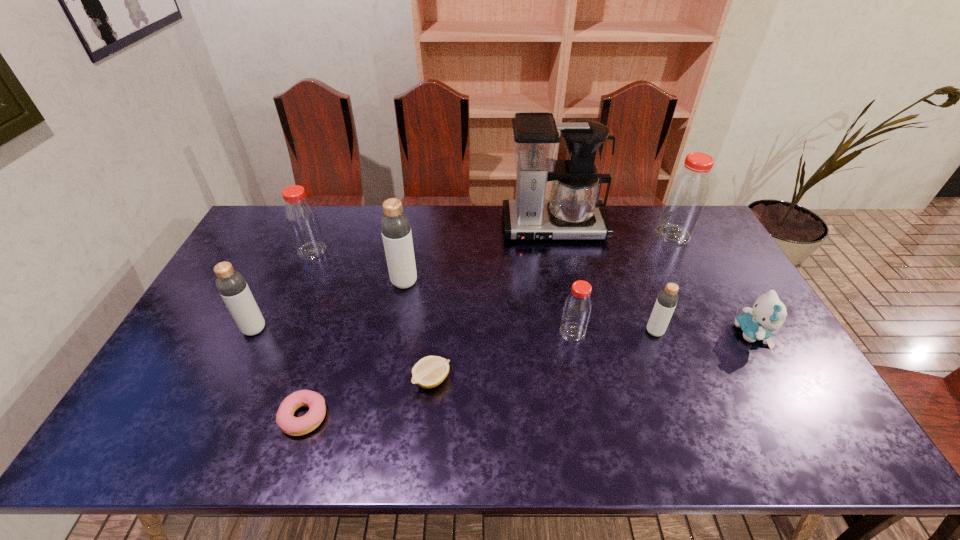
In order to click on object that is the eighth closest to the nearest red bottle in this screenshot , I will do [302, 220].

Identify which bottle is located as the third nearest to the rightmost bottle. Please provide its 2D coordinates. Your answer should be formatted as a tuple, i.e. [(x, y)], where the tuple contains the x and y coordinates of a point satisfying the conditions above.

[(395, 226)]

Locate an element on the screen. The image size is (960, 540). bottle that is the second closest one to the fourth object from left to right is located at coordinates (232, 286).

Find the location of a particular element. The height and width of the screenshot is (540, 960). red bottle that is the closest to the blue kitten is located at coordinates (685, 200).

Point out which red bottle is positioned as the second nearest to the biggest red bottle. Please provide its 2D coordinates. Your answer should be formatted as a tuple, i.e. [(x, y)], where the tuple contains the x and y coordinates of a point satisfying the conditions above.

[(302, 220)]

Where is `gray bottle object that ranks as the closest to the biggest red bottle`? The height and width of the screenshot is (540, 960). gray bottle object that ranks as the closest to the biggest red bottle is located at coordinates (667, 299).

The image size is (960, 540). I want to click on the second closest gray bottle to the pink doughnut, so click(395, 226).

Find the location of a particular element. Image resolution: width=960 pixels, height=540 pixels. vacant space that satisfies the following two spatial constraints: 1. on the back side of the seventh object from right to left; 2. on the left side of the rightmost red bottle is located at coordinates (413, 234).

In order to click on vacant region that satisfies the following two spatial constraints: 1. on the front side of the second biggest gray bottle; 2. on the right side of the pink doughnut in this screenshot , I will do `click(212, 417)`.

I want to click on vacant space that satisfies the following two spatial constraints: 1. on the back side of the rightmost red bottle; 2. on the left side of the yellow lemon, so click(445, 234).